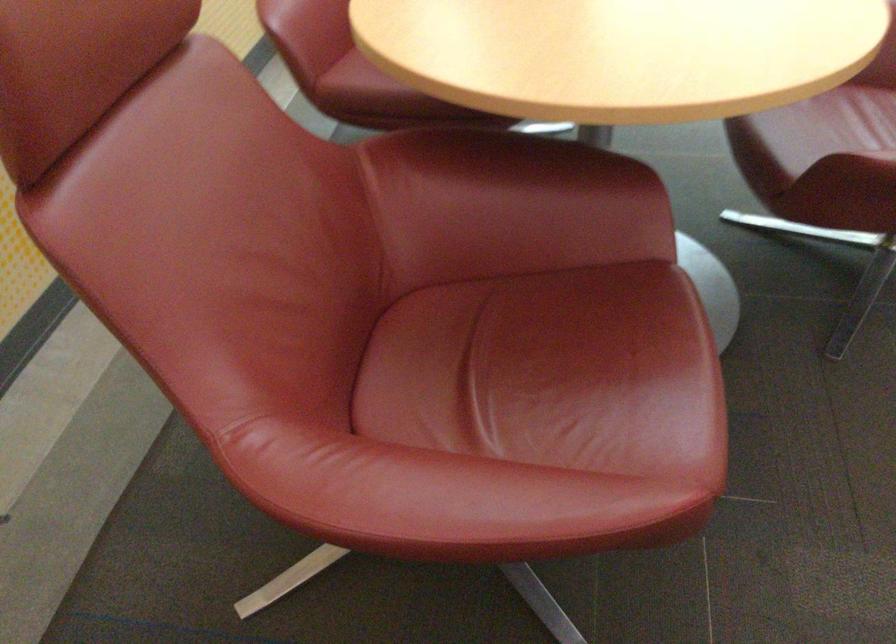
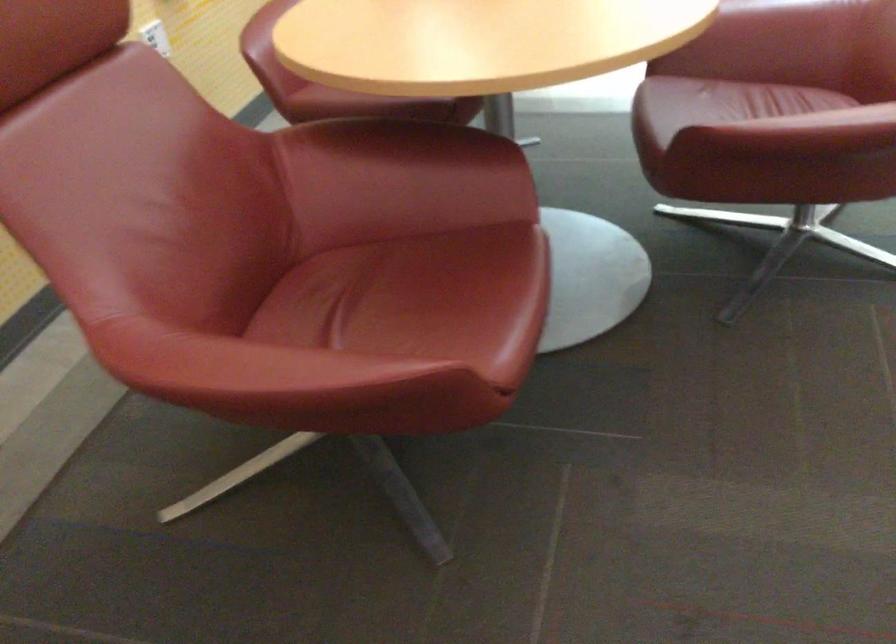
Question: The camera is either moving clockwise (left) or counter-clockwise (right) around the object. The first image is from the beginning of the video and the second image is from the end. Is the camera moving left or right when shooting the video?

Choices:
 (A) Left
 (B) Right

Answer: (B)